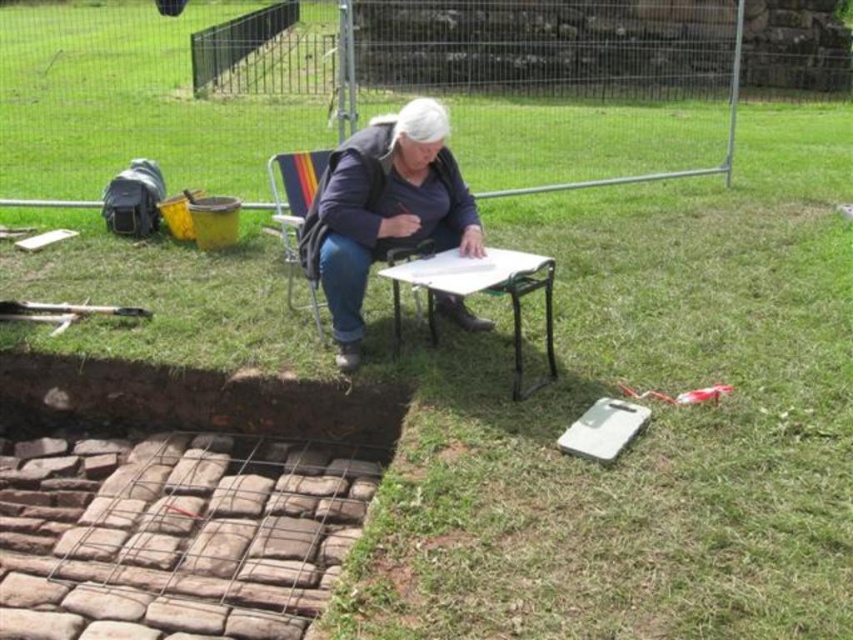
You are an archaeologist standing at the excavation site. You need to place a new marker at the exact center of the site. Where should you place it relative to the blue fabric jacket at center?

The blue fabric jacket at center is already positioned at the exact center of the site at coordinates point (384, 209), so placing the marker there would be correct.

You are an archaeologist standing at the edge of the excavation pit. You need to move the blue fabric jacket at center and the white plastic table at center to a safer location away from the pit. Which object should you move first to ensure you can access the other afterward?

You should move the blue fabric jacket at center first because the white plastic table at center is behind it. By moving the jacket first, you will have clear access to the table to move it afterward.

You are an archaeologist standing at the edge of the excavation pit and need to reach both the white plastic table at center and the metallic folding chair at center. Which object will you encounter first as you walk towards them?

You will encounter the white plastic table at center first because it is closer to you than the metallic folding chair at center.